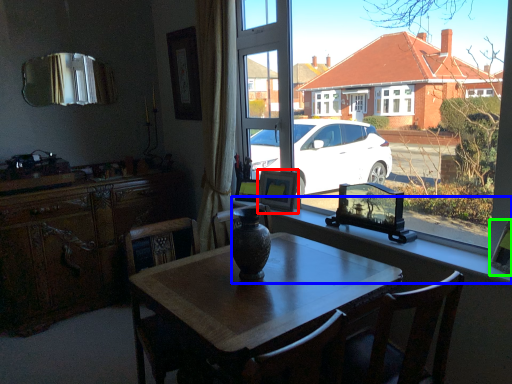
Question: Which is farther away from picture frame (highlighted by a red box)? window sill (highlighted by a blue box) or picture frame (highlighted by a green box)?

Choices:
 (A) window sill
 (B) picture frame

Answer: (B)